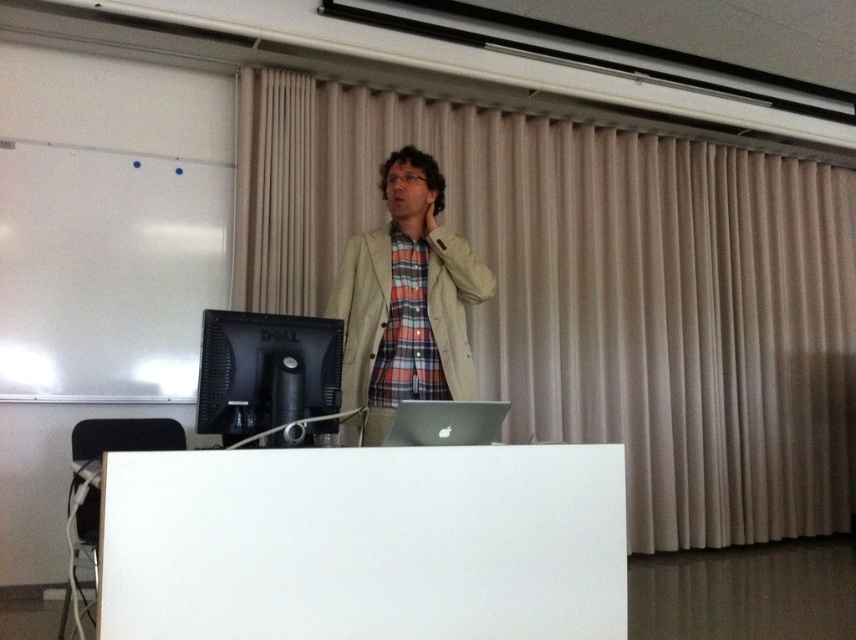
Looking at this image, you are a stagehand setting up for an event. You need to place a 7.5 feet long extension cord from the beige fabric curtain at upper center to the black glossy monitor at lower left. Will the cord reach without needing to be extended further?

The distance between the beige fabric curtain at upper center and the black glossy monitor at lower left is 8.62 feet. Since the extension cord is 7.5 feet long, it is shorter than the required distance. The cord will not reach, so you need a longer one or extend it further.

You are a stagehand setting up for a presentation. You need to determine if the beige fabric curtain at upper center can be lowered to cover the black glossy monitor at lower left. Based on their heights, is this possible?

The beige fabric curtain at upper center is much taller than the black glossy monitor at lower left, so it can be lowered to cover it.

You are organizing a classroom setup and need to ensure that all items fit on a shelf. The shelf has a maximum weight capacity of 20 kilograms. The light beige fabric jacket at center and the black glossy monitor at lower left need to be placed on this shelf. Which item should you place first to ensure stability?

The light beige fabric jacket at center is larger in size than the black glossy monitor at lower left, so placing the larger item first ensures stability on the shelf.